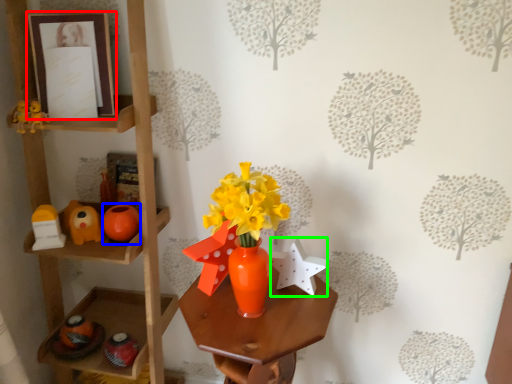
Question: Which is farther away from picture frame (highlighted by a red box)? toy (highlighted by a blue box) or toy (highlighted by a green box)?

Choices:
 (A) toy
 (B) toy

Answer: (B)